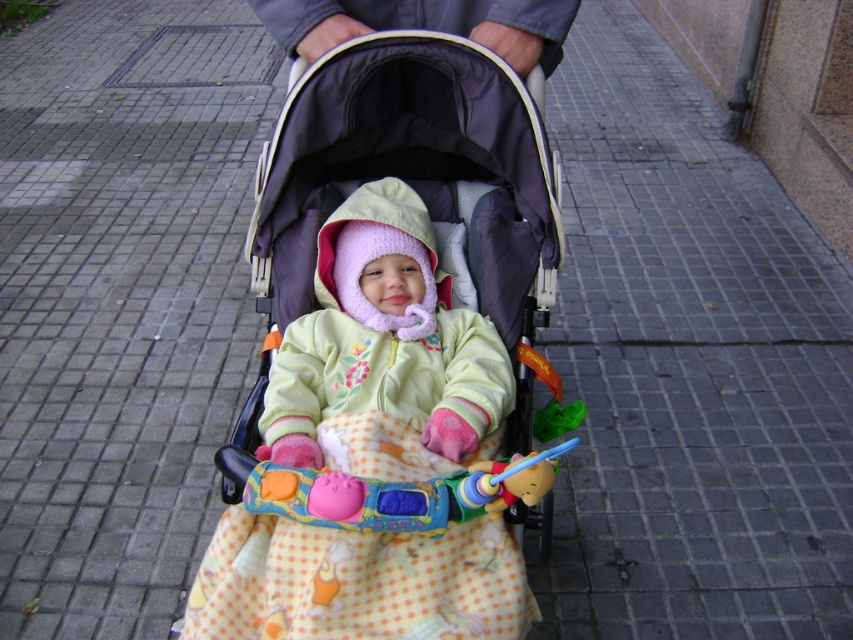
You are a parent holding a 3.5 feet long umbrella. You want to shield the baby from the sudden rain while pushing the stroller. Can you hold the umbrella above the light green fleece jacket at center without it touching the baby?

The light green fleece jacket at center is 4.53 feet away from the viewer. Since the umbrella is 3.5 feet long, the parent can hold it above the jacket without it touching the baby as the distance allows enough space.

You are a parent pushing a stroller and want to place a toy so that it is visible to the baby. Given the current arrangement, where should you position the plastic colorful toy at center relative to the dark purple fabric baby carriage at center?

The dark purple fabric baby carriage at center is to the left of the plastic colorful toy at center, so the plastic colorful toy at center is positioned to the right of the dark purple fabric baby carriage at center. This placement ensures the toy is visible to the baby in the stroller.